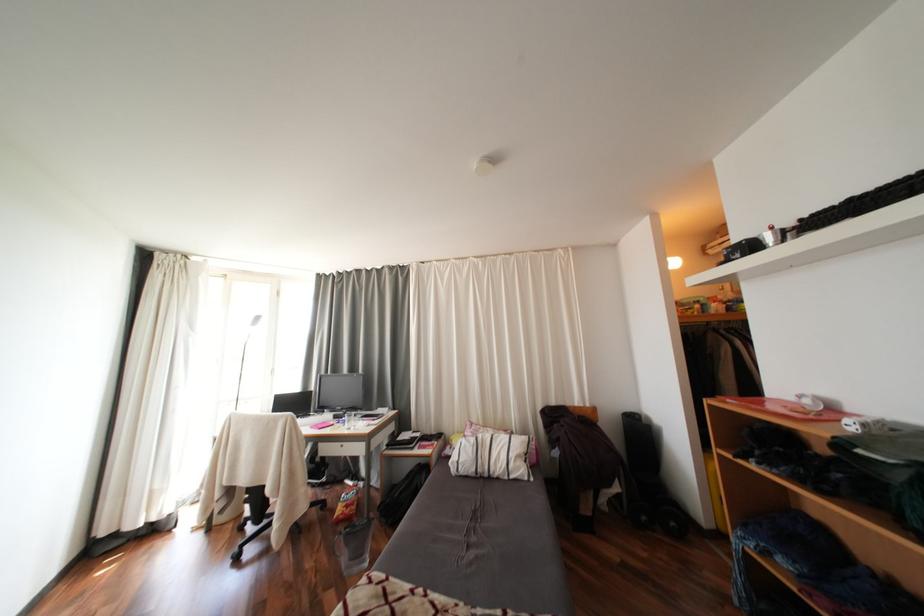
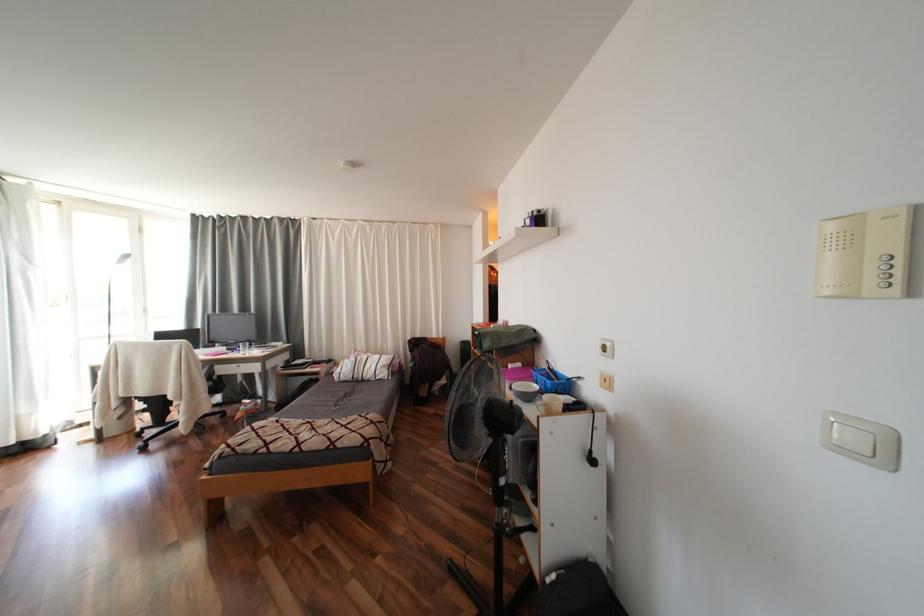
The images are taken continuously from a first-person perspective. In which direction are you moving?

The cameraman walked toward right, backward.